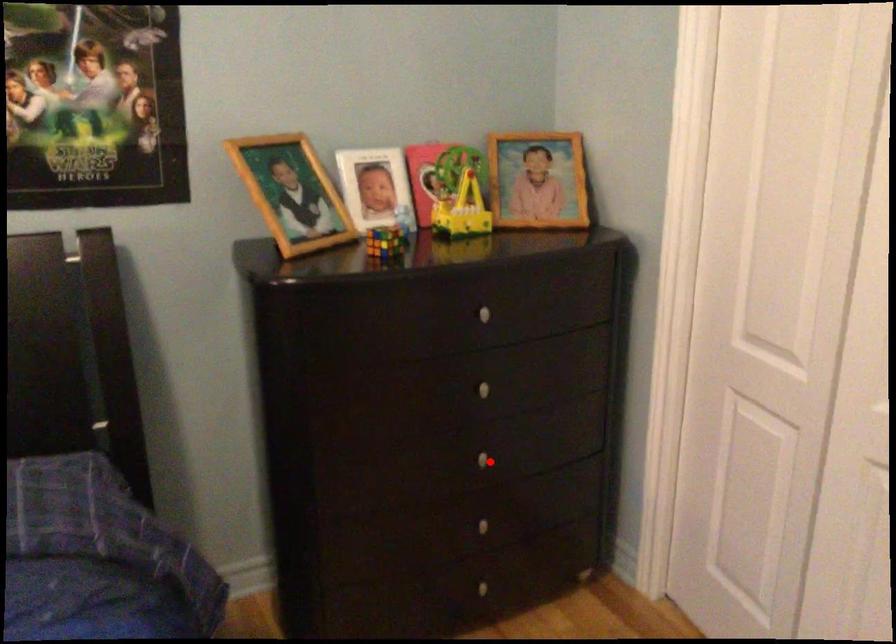
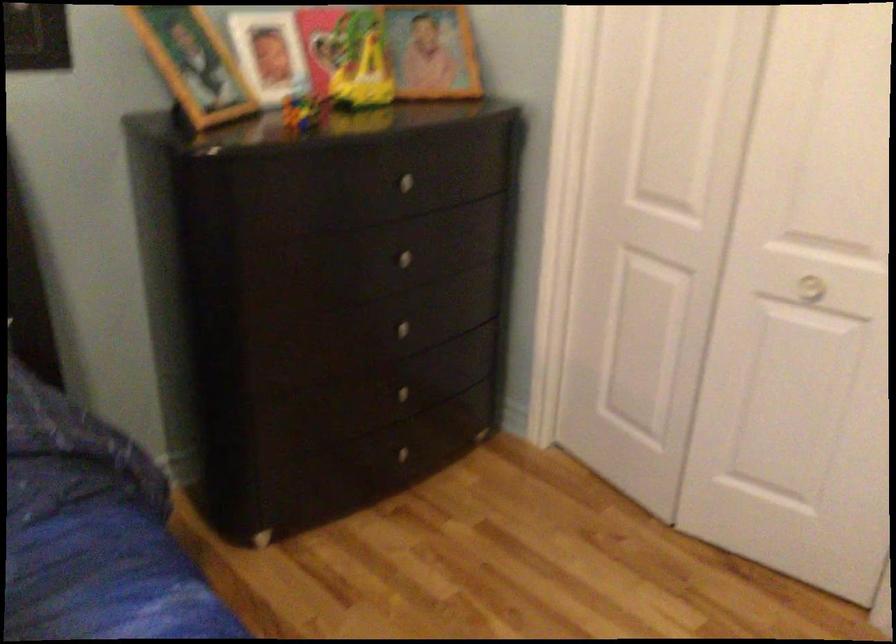
Locate, in the second image, the point that corresponds to the highlighted location in the first image.

(409, 332)